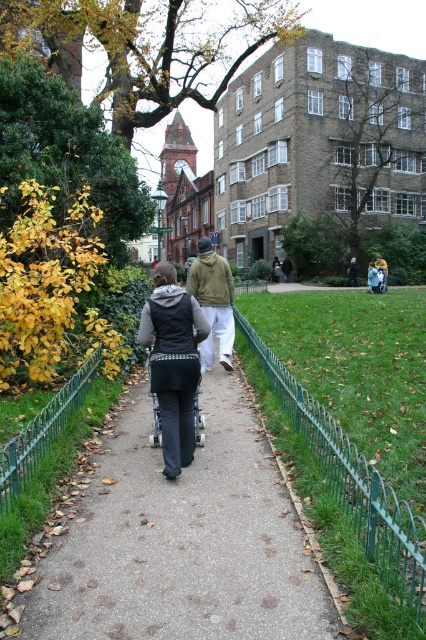
Question: Can you confirm if concrete pavement at center is thinner than metallic blue baby carriage at center?

Choices:
 (A) no
 (B) yes

Answer: (A)

Question: Is matte black vest at center wider than matte green jacket at center?

Choices:
 (A) no
 (B) yes

Answer: (A)

Question: Which point appears farthest from the camera in this image?

Choices:
 (A) (152, 580)
 (B) (385, 282)
 (C) (196, 352)
 (D) (152, 346)

Answer: (B)

Question: Which object is the closest to the concrete pavement at center?

Choices:
 (A) khaki cotton jacket at center
 (B) metallic blue baby carriage at center

Answer: (B)

Question: In this image, where is light brown cotton hoodie at center located relative to khaki cotton jacket at center?

Choices:
 (A) below
 (B) above

Answer: (A)

Question: Which point is closer to the camera?

Choices:
 (A) (154, 332)
 (B) (201, 291)

Answer: (A)